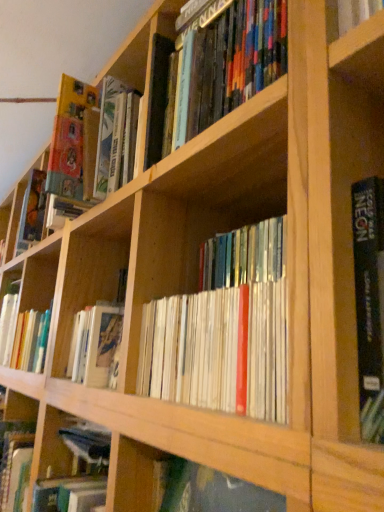
Question: Can you confirm if wooden bookshelf at center is smaller than wooden bookshelf at center?

Choices:
 (A) yes
 (B) no

Answer: (A)

Question: Does wooden bookshelf at center have a larger size compared to wooden bookshelf at center?

Choices:
 (A) yes
 (B) no

Answer: (B)

Question: From a real-world perspective, is wooden bookshelf at center on wooden bookshelf at center?

Choices:
 (A) yes
 (B) no

Answer: (B)

Question: Is wooden bookshelf at center completely or partially outside of wooden bookshelf at center?

Choices:
 (A) no
 (B) yes

Answer: (B)

Question: Does wooden bookshelf at center lie in front of wooden bookshelf at center?

Choices:
 (A) yes
 (B) no

Answer: (A)

Question: Can you confirm if wooden bookshelf at center is positioned to the right of wooden bookshelf at center?

Choices:
 (A) no
 (B) yes

Answer: (B)

Question: Does wooden bookshelf at center contain wooden bookshelf at center?

Choices:
 (A) no
 (B) yes

Answer: (A)

Question: Is wooden bookshelf at center placed right next to wooden bookshelf at center?

Choices:
 (A) yes
 (B) no

Answer: (B)

Question: From a real-world perspective, is wooden bookshelf at center positioned under wooden bookshelf at center based on gravity?

Choices:
 (A) yes
 (B) no

Answer: (B)

Question: Is wooden bookshelf at center facing away from wooden bookshelf at center?

Choices:
 (A) yes
 (B) no

Answer: (B)

Question: Would you consider wooden bookshelf at center to be distant from wooden bookshelf at center?

Choices:
 (A) yes
 (B) no

Answer: (B)

Question: Is wooden bookshelf at center at the left side of wooden bookshelf at center?

Choices:
 (A) no
 (B) yes

Answer: (B)

Question: In the image, is wooden bookshelf at center on the left side or the right side of wooden bookshelf at center?

Choices:
 (A) right
 (B) left

Answer: (A)